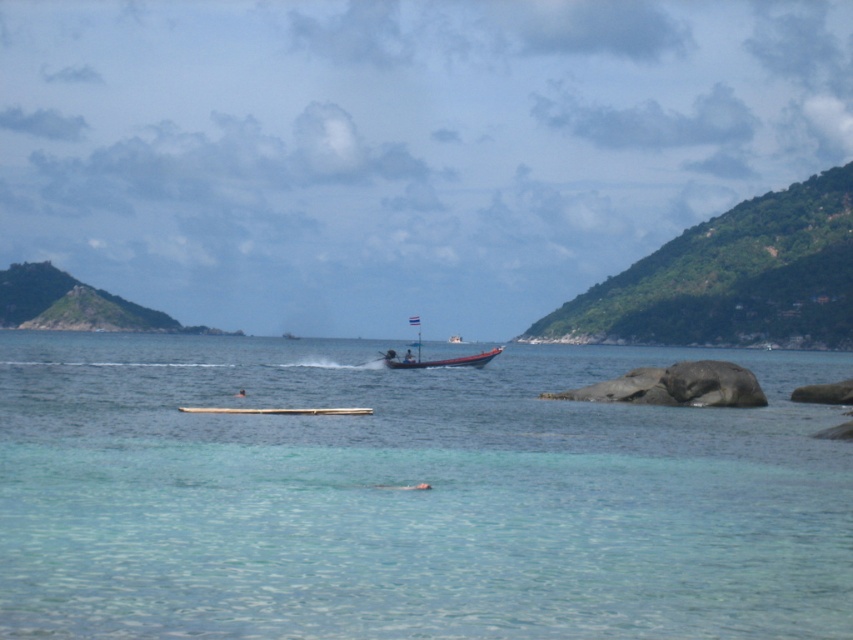
Question: Which of the following is the closest to the observer?

Choices:
 (A) red plastic boat at center
 (B) clear water at center

Answer: (B)

Question: Among these objects, which one is nearest to the camera?

Choices:
 (A) clear water at center
 (B) red plastic boat at center
 (C) wooden boat at center

Answer: (A)

Question: Is clear water at center bigger than wooden boat at center?

Choices:
 (A) yes
 (B) no

Answer: (A)

Question: Observing the image, what is the correct spatial positioning of clear water at center in reference to red plastic boat at center?

Choices:
 (A) right
 (B) left

Answer: (B)

Question: Which of the following is the farthest from the observer?

Choices:
 (A) coord(489,356)
 (B) coord(711,593)

Answer: (A)

Question: Does clear water at center have a lesser width compared to wooden boat at center?

Choices:
 (A) yes
 (B) no

Answer: (B)